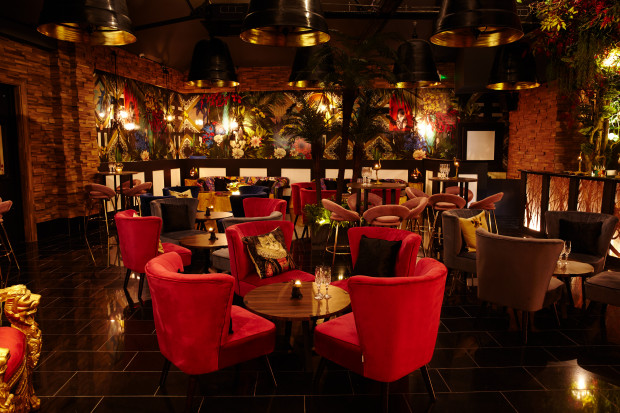
Locate an element on the screen. bell shaped large overhead lights is located at coordinates (208, 69), (110, 21), (291, 16), (312, 67), (421, 60), (477, 24), (511, 81).